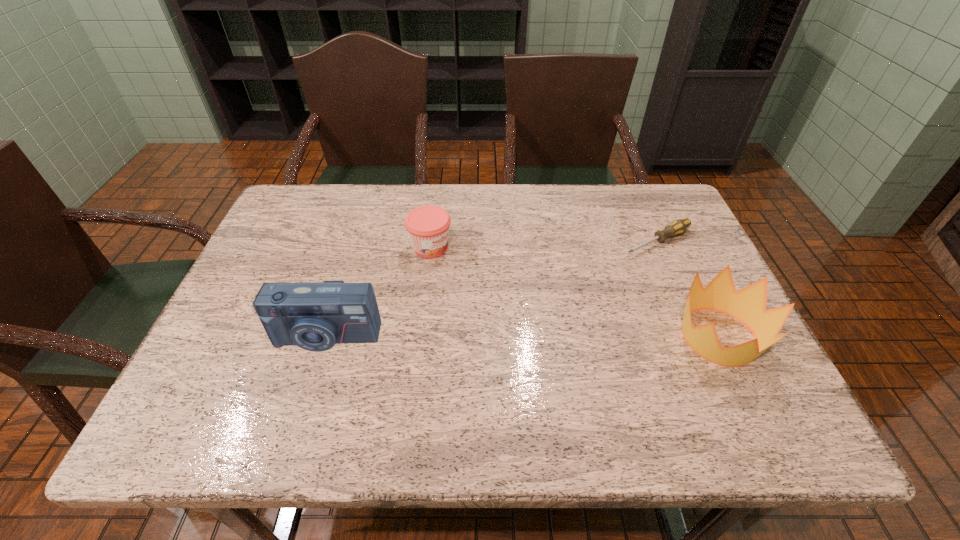
Image resolution: width=960 pixels, height=540 pixels. I want to click on camera, so click(x=314, y=316).

The image size is (960, 540). I want to click on crown, so click(748, 305).

In order to click on jam in this screenshot , I will do `click(428, 226)`.

You are a GUI agent. You are given a task and a screenshot of the screen. Output one action in this format:
    pyautogui.click(x=<x>, y=<y>)
    Task: Click on the second shortest object
    The width and height of the screenshot is (960, 540).
    Given the screenshot: What is the action you would take?
    pyautogui.click(x=428, y=226)

I want to click on the shortest object, so click(x=679, y=226).

Find the location of a particular element. vacant space situated on the left of the crown is located at coordinates (647, 337).

You are a GUI agent. You are given a task and a screenshot of the screen. Output one action in this format:
    pyautogui.click(x=<x>, y=<y>)
    Task: Click on the vacant area located on the front label of the third object from right to left
    This screenshot has width=960, height=540.
    Given the screenshot: What is the action you would take?
    pyautogui.click(x=550, y=324)

Locate an element on the screen. free space located 0.370m on the front label of the third object from right to left is located at coordinates (561, 331).

This screenshot has width=960, height=540. What are the coordinates of `vacant area located on the front label of the third object from right to left` in the screenshot? It's located at (513, 300).

Image resolution: width=960 pixels, height=540 pixels. In order to click on free space located at the tip of the shortest object in this screenshot , I will do `click(509, 312)`.